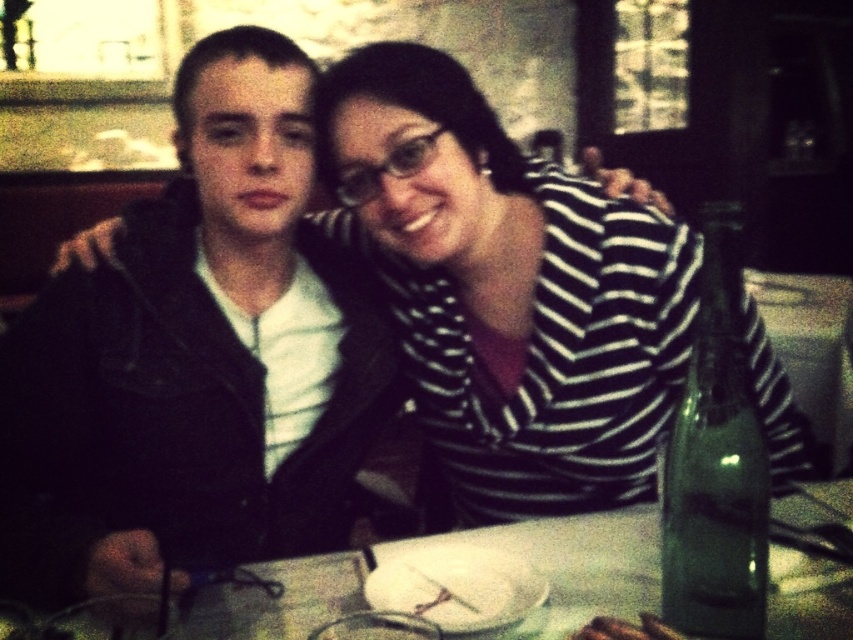
The height and width of the screenshot is (640, 853). Identify the location of white glossy table at center. (576, 564).

Who is more distant from viewer, (654, 561) or (740, 275)?

Positioned behind is point (654, 561).

In order to click on white glossy table at center in this screenshot , I will do `click(576, 564)`.

Who is taller, denim jacket at left or green glass bottle at right?

Standing taller between the two is denim jacket at left.

Does denim jacket at left appear on the right side of green glass bottle at right?

No, denim jacket at left is not to the right of green glass bottle at right.

Find the location of a particular element. Image resolution: width=853 pixels, height=640 pixels. denim jacket at left is located at coordinates (195, 360).

Locate an element on the screen. denim jacket at left is located at coordinates (195, 360).

You are a GUI agent. You are given a task and a screenshot of the screen. Output one action in this format:
    pyautogui.click(x=<x>, y=<y>)
    Task: Click on the denim jacket at left
    This screenshot has height=640, width=853.
    Given the screenshot: What is the action you would take?
    pyautogui.click(x=195, y=360)